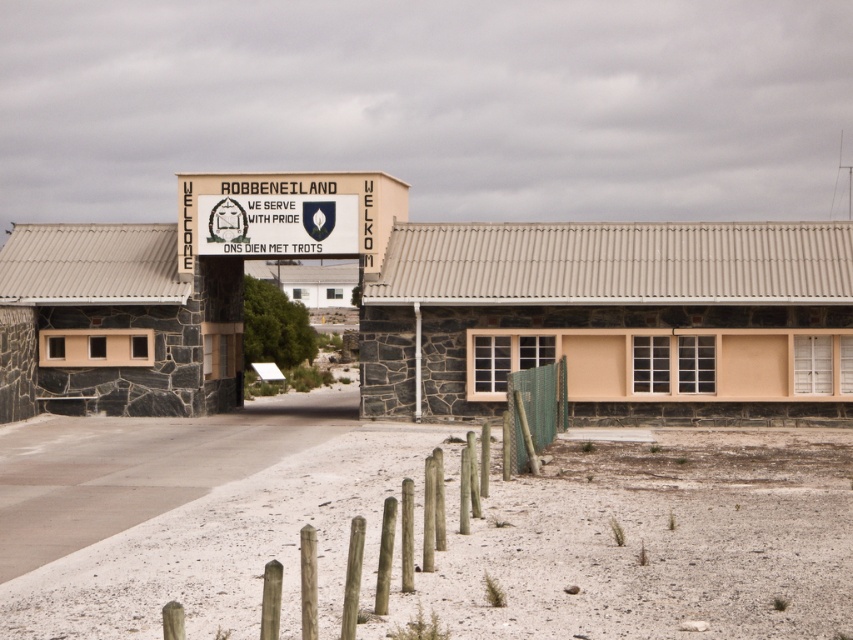
Is point (402, 196) closer to camera compared to point (521, 396)?

No, it is behind (521, 396).

Which is more to the right, white plastic sign at center or green mesh fence at lower center?

green mesh fence at lower center is more to the right.

Is point (357, 180) positioned before point (508, 374)?

No, it is not.

At what (x,y) coordinates should I click in order to perform the action: click on white plastic sign at center. Please return your answer as a coordinate pair (x, y). The height and width of the screenshot is (640, 853). Looking at the image, I should click on (288, 214).